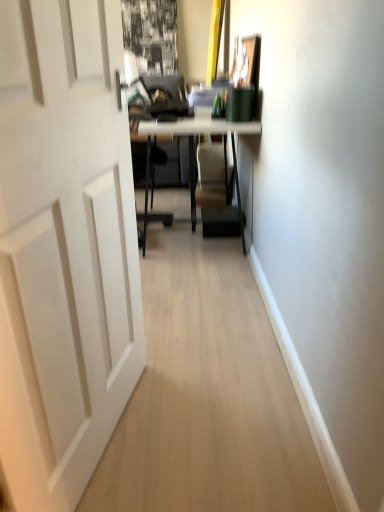
Question: Do you think matte white table at center is within white matte door at left, or outside of it?

Choices:
 (A) inside
 (B) outside

Answer: (B)

Question: From a real-world perspective, relative to white matte door at left, is matte white table at center vertically above or below?

Choices:
 (A) below
 (B) above

Answer: (A)

Question: Considering the positions of point (243, 247) and point (119, 46), is point (243, 247) closer or farther from the camera than point (119, 46)?

Choices:
 (A) closer
 (B) farther

Answer: (B)

Question: Considering their positions, is white matte door at left located in front of or behind matte white table at center?

Choices:
 (A) behind
 (B) front

Answer: (B)

Question: Is point (84, 367) closer or farther from the camera than point (173, 122)?

Choices:
 (A) farther
 (B) closer

Answer: (B)

Question: Is white matte door at left bigger or smaller than matte white table at center?

Choices:
 (A) big
 (B) small

Answer: (B)

Question: From the image's perspective, is white matte door at left located above or below matte white table at center?

Choices:
 (A) above
 (B) below

Answer: (B)